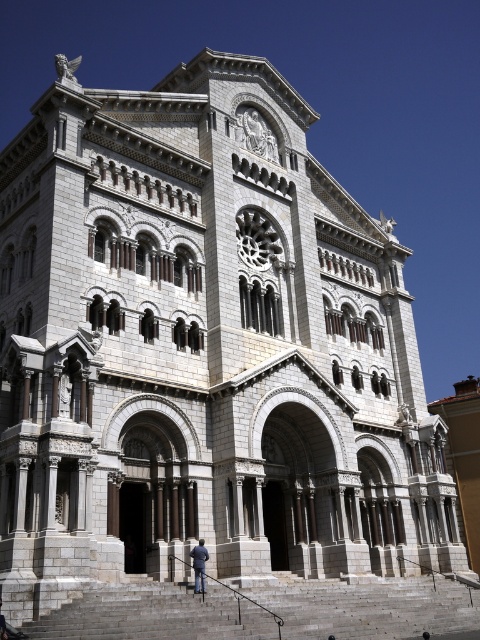
You are standing in front of the grand building and see the gray stone stairs at lower center and the blue jeans at lower center. Which object is closer to the ground?

The blue jeans at lower center are closer to the ground since the gray stone stairs at lower center are taller than them.

You are standing in front of the grand building and see the gray stone stairs at lower center and the blue jeans at lower center. Which object is larger in size?

The gray stone stairs at lower center is bigger than the blue jeans at lower center.